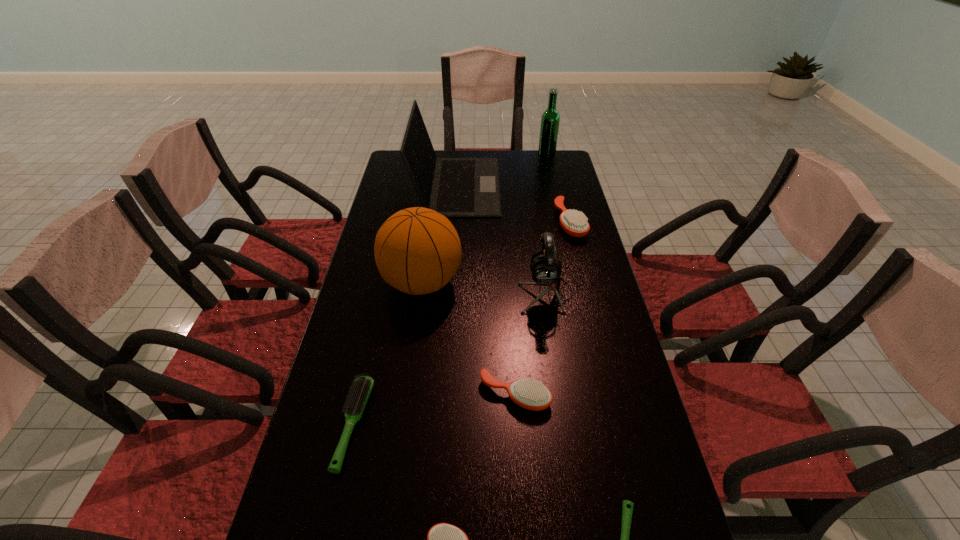
You are a GUI agent. You are given a task and a screenshot of the screen. Output one action in this format:
    pyautogui.click(x=<x>, y=<y>)
    Task: Click on the bigger light hairbrush
    Image resolution: width=960 pixels, height=540 pixels.
    Given the screenshot: What is the action you would take?
    pyautogui.click(x=361, y=389)

Locate an element on the screen. free space located on the left of the farthest object is located at coordinates (517, 155).

Where is `vacant position located 0.100m on the screen of the laptop`? The height and width of the screenshot is (540, 960). vacant position located 0.100m on the screen of the laptop is located at coordinates (525, 186).

Locate an element on the screen. This screenshot has height=540, width=960. free space located 0.100m on the front of the basketball is located at coordinates (414, 341).

Identify the location of free location located on the left of the earphone. The image size is (960, 540). (450, 294).

Where is `vacant space located 0.330m on the front of the rightmost orange hairbrush`? Image resolution: width=960 pixels, height=540 pixels. vacant space located 0.330m on the front of the rightmost orange hairbrush is located at coordinates (593, 316).

Locate an element on the screen. The width and height of the screenshot is (960, 540). free space located 0.230m on the left of the second nearest orange hairbrush is located at coordinates (383, 395).

At what (x,y) coordinates should I click in order to perform the action: click on free point located on the back of the bigger light hairbrush. Please return your answer as a coordinate pair (x, y). Looking at the image, I should click on (375, 330).

I want to click on beer bottle present at the far edge, so click(550, 119).

Find the location of a particular element. This screenshot has width=960, height=540. laptop present at the far edge is located at coordinates [455, 187].